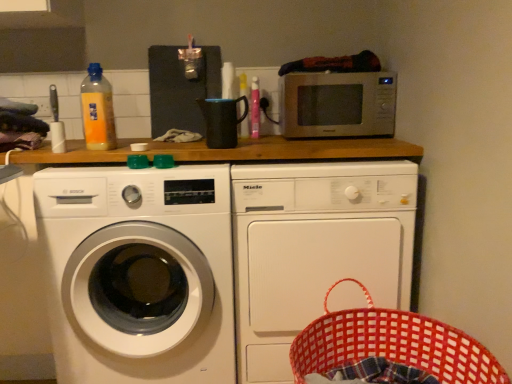
Question: Can you confirm if translucent plastic bottle at upper center, which ranks as the second bottle in left-to-right order, is positioned to the left of satin silver microwave at upper center?

Choices:
 (A) yes
 (B) no

Answer: (A)

Question: Is translucent plastic bottle at upper center, the first bottle from the back, outside satin silver microwave at upper center?

Choices:
 (A) yes
 (B) no

Answer: (A)

Question: Are translucent plastic bottle at upper center, marked as the first bottle in a right-to-left arrangement, and satin silver microwave at upper center far apart?

Choices:
 (A) yes
 (B) no

Answer: (B)

Question: Does translucent plastic bottle at upper center, the first bottle from the back, have a lesser width compared to satin silver microwave at upper center?

Choices:
 (A) yes
 (B) no

Answer: (A)

Question: Does translucent plastic bottle at upper center, the 2th bottle from the front, contain satin silver microwave at upper center?

Choices:
 (A) yes
 (B) no

Answer: (B)

Question: From a real-world perspective, is translucent plastic bottle at upper center, which ranks as the second bottle in left-to-right order, positioned above or below white matte washing machine at center, which appears as the first washing machine when viewed from the right?

Choices:
 (A) above
 (B) below

Answer: (A)

Question: Which is correct: translucent plastic bottle at upper center, marked as the first bottle in a right-to-left arrangement, is inside white matte washing machine at center, which appears as the first washing machine when viewed from the right, or outside of it?

Choices:
 (A) inside
 (B) outside

Answer: (B)

Question: From the image's perspective, is translucent plastic bottle at upper center, the 2th bottle from the front, positioned above or below white matte washing machine at center, which appears as the first washing machine when viewed from the right?

Choices:
 (A) above
 (B) below

Answer: (A)

Question: Considering the positions of translucent plastic bottle at upper center, the 2th bottle from the front, and white matte washing machine at center, the 2th washing machine positioned from the left, in the image, is translucent plastic bottle at upper center, the 2th bottle from the front, taller or shorter than white matte washing machine at center, the 2th washing machine positioned from the left,?

Choices:
 (A) short
 (B) tall

Answer: (A)

Question: Which is correct: white matte washing machine at center, which appears as the first washing machine when viewed from the right, is inside white glossy washing machine at left, the 2th washing machine from the right, or outside of it?

Choices:
 (A) inside
 (B) outside

Answer: (B)

Question: Is point (374, 208) closer or farther from the camera than point (47, 258)?

Choices:
 (A) farther
 (B) closer

Answer: (A)

Question: From a real-world perspective, is white matte washing machine at center, the 2th washing machine positioned from the left, physically located above or below white glossy washing machine at left, the 2th washing machine from the right?

Choices:
 (A) below
 (B) above

Answer: (A)

Question: Is white matte washing machine at center, the 2th washing machine positioned from the left, to the left or to the right of white glossy washing machine at left, arranged as the first washing machine when viewed from the left, in the image?

Choices:
 (A) right
 (B) left

Answer: (A)

Question: Considering the positions of white glossy washing machine at left, the 2th washing machine from the right, and translucent plastic bottle at upper center, marked as the first bottle in a right-to-left arrangement, in the image, is white glossy washing machine at left, the 2th washing machine from the right, wider or thinner than translucent plastic bottle at upper center, marked as the first bottle in a right-to-left arrangement,?

Choices:
 (A) wide
 (B) thin

Answer: (A)

Question: Is point [x=110, y=246] positioned closer to the camera than point [x=240, y=74]?

Choices:
 (A) farther
 (B) closer

Answer: (B)